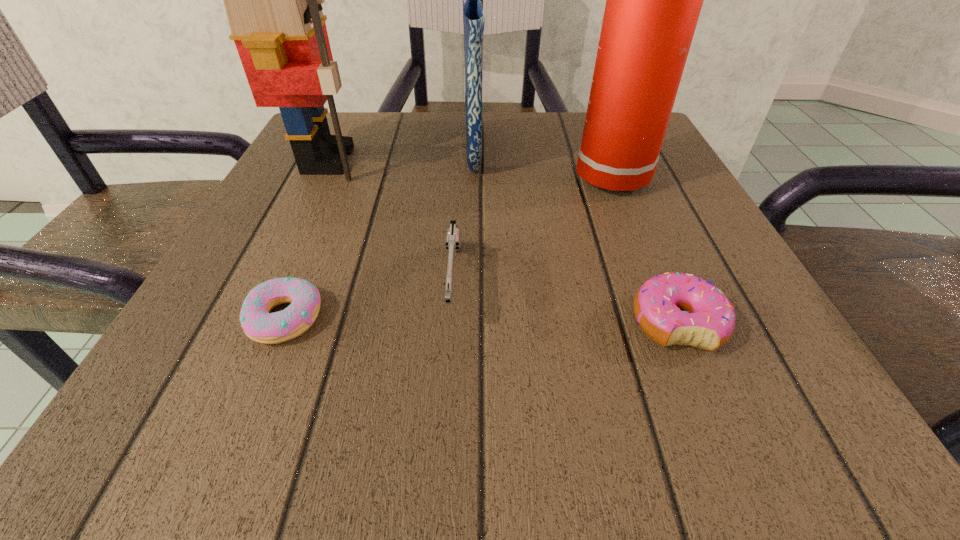
Locate an element on the screen. blank area located 0.250m at the nozzle of the fire extinguisher is located at coordinates (437, 178).

This screenshot has height=540, width=960. I want to click on blank space located at the nozzle of the fire extinguisher, so click(x=541, y=178).

You are a GUI agent. You are given a task and a screenshot of the screen. Output one action in this format:
    pyautogui.click(x=<x>, y=<y>)
    Task: Click on the vacant space located in front of the nutcracker holding the staff
    Image resolution: width=960 pixels, height=540 pixels.
    Given the screenshot: What is the action you would take?
    pyautogui.click(x=548, y=160)

Find the location of a particular element. The image size is (960, 540). vacant space situated 0.070m on the front-facing side of the pistol is located at coordinates (447, 384).

I want to click on vacant region located 0.170m on the back of the fifth tallest object, so click(632, 216).

You are a GUI agent. You are given a task and a screenshot of the screen. Output one action in this format:
    pyautogui.click(x=<x>, y=<y>)
    Task: Click on the vacant space located on the back of the shorter doughnut
    
    Given the screenshot: What is the action you would take?
    pyautogui.click(x=311, y=256)

At what (x,y) coordinates should I click in order to perform the action: click on shopping bag situated at the far edge. Please return your answer as a coordinate pair (x, y). Looking at the image, I should click on (473, 17).

The image size is (960, 540). I want to click on fire extinguisher positioned at the far edge, so click(653, 0).

Where is `nutcracker present at the far edge`? nutcracker present at the far edge is located at coordinates (273, 0).

Locate an element on the screen. This screenshot has width=960, height=540. nutcracker that is at the left edge is located at coordinates tap(273, 0).